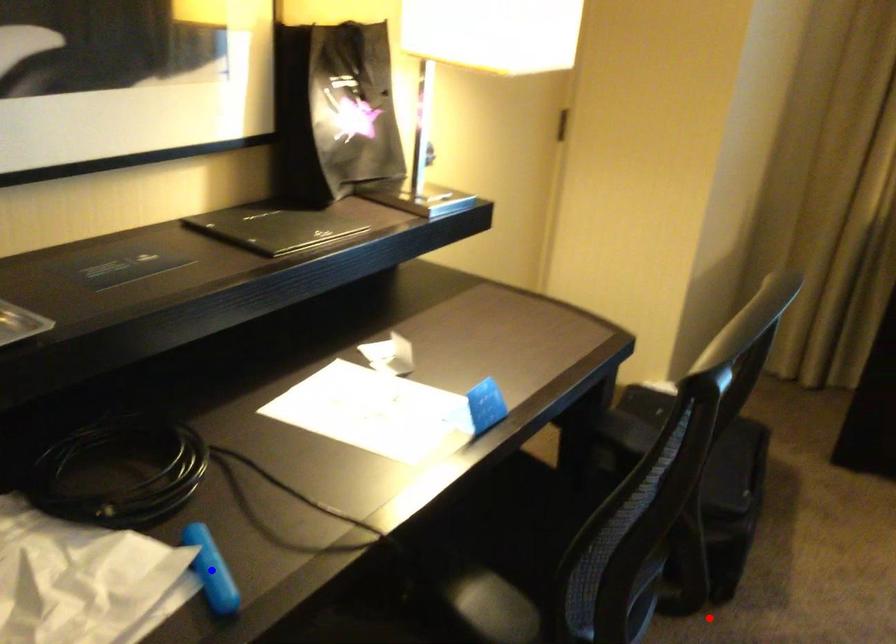
Question: Which of the two points in the image is closer to the camera?

Choices:
 (A) Blue point is closer.
 (B) Red point is closer.

Answer: (A)